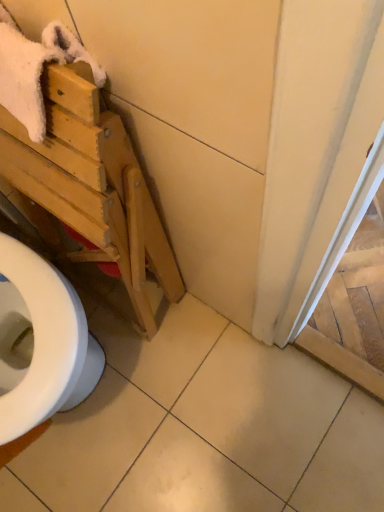
The image size is (384, 512). Describe the element at coordinates (92, 184) in the screenshot. I see `light wood folding chair at left` at that location.

What is the approximate height of white fluffy bath towel at upper left?

It is 14.24 centimeters.

In order to face white fluffy bath towel at upper left, should I rotate leftwards or rightwards?

It's best to rotate left around 25.470 degrees.

Locate an element on the screen. light wood folding chair at left is located at coordinates (92, 184).

Who is shorter, light wood folding chair at left or white fluffy bath towel at upper left?

white fluffy bath towel at upper left.

Is light wood folding chair at left to the right of white fluffy bath towel at upper left from the viewer's perspective?

Correct, you'll find light wood folding chair at left to the right of white fluffy bath towel at upper left.

Considering the points (1, 51) and (355, 473), which point is in front, point (1, 51) or point (355, 473)?

The point (1, 51) is more forward.

Relative to white tile at center, is white fluffy bath towel at upper left in front or behind?

white fluffy bath towel at upper left is positioned closer to the viewer than white tile at center.

Considering the positions of objects white fluffy bath towel at upper left and white tile at center in the image provided, who is more to the left, white fluffy bath towel at upper left or white tile at center?

From the viewer's perspective, white fluffy bath towel at upper left appears more on the left side.

Can you confirm if white fluffy bath towel at upper left is bigger than white tile at center?

Incorrect, white fluffy bath towel at upper left is not larger than white tile at center.

Which of these two, white fluffy bath towel at upper left or light wood folding chair at left, stands shorter?

white fluffy bath towel at upper left is shorter.

Is white fluffy bath towel at upper left behind light wood folding chair at left?

Yes, it is behind light wood folding chair at left.

Is white fluffy bath towel at upper left bigger than light wood folding chair at left?

Incorrect, white fluffy bath towel at upper left is not larger than light wood folding chair at left.

Does white fluffy bath towel at upper left have a greater width compared to light wood folding chair at left?

In fact, white fluffy bath towel at upper left might be narrower than light wood folding chair at left.

From a real-world perspective, between white tile at center and white fluffy bath towel at upper left, who is vertically lower?

From a 3D spatial view, white tile at center is below.

Find the location of a particular element. bath towel in front of the white tile at center is located at coordinates (35, 70).

From a real-world perspective, is white tile at center located higher than light wood folding chair at left?

No, from a real-world perspective, white tile at center is not above light wood folding chair at left.

Is light wood folding chair at left surrounded by white tile at center?

No, white tile at center does not contain light wood folding chair at left.

Is white tile at center turned away from light wood folding chair at left?

No, white tile at center is not facing away from light wood folding chair at left.

Between light wood folding chair at left and white tile at center, which one has smaller size?

Smaller between the two is white tile at center.

Would you say white tile at center is part of light wood folding chair at left's contents?

No, light wood folding chair at left does not contain white tile at center.

Does point (90, 131) appear closer or farther from the camera than point (103, 407)?

Point (90, 131).

Is there a large distance between light wood folding chair at left and white tile at center?

Actually, light wood folding chair at left and white tile at center are a little close together.

Find the location of `bath towel above the light wood folding chair at left (from the image's perspective)`. bath towel above the light wood folding chair at left (from the image's perspective) is located at coordinates (35, 70).

At what (x,y) coordinates should I click in order to perform the action: click on tile that appears below the white fluffy bath towel at upper left (from a real-world perspective). Please return your answer as a coordinate pair (x, y). The width and height of the screenshot is (384, 512). Looking at the image, I should click on (205, 428).

Based on their spatial positions, is white tile at center or white fluffy bath towel at upper left further from light wood folding chair at left?

white tile at center lies further to light wood folding chair at left than the other object.

When comparing their distances from light wood folding chair at left, does white fluffy bath towel at upper left or white tile at center seem further?

white tile at center lies further to light wood folding chair at left than the other object.

Estimate the real-world distances between objects in this image. Which object is closer to white tile at center, white fluffy bath towel at upper left or light wood folding chair at left?

light wood folding chair at left is positioned closer to the anchor white tile at center.

In the scene shown: Which object lies further to the anchor point white tile at center, light wood folding chair at left or white fluffy bath towel at upper left?

The object further to white tile at center is white fluffy bath towel at upper left.

From the image, which object appears to be farther from white fluffy bath towel at upper left, light wood folding chair at left or white tile at center?

white tile at center is positioned further to the anchor white fluffy bath towel at upper left.

From the image, which object appears to be nearer to white fluffy bath towel at upper left, white tile at center or light wood folding chair at left?

The object closer to white fluffy bath towel at upper left is light wood folding chair at left.

Where is `furniture between white fluffy bath towel at upper left and white tile at center in the vertical direction`? Image resolution: width=384 pixels, height=512 pixels. furniture between white fluffy bath towel at upper left and white tile at center in the vertical direction is located at coordinates (92, 184).